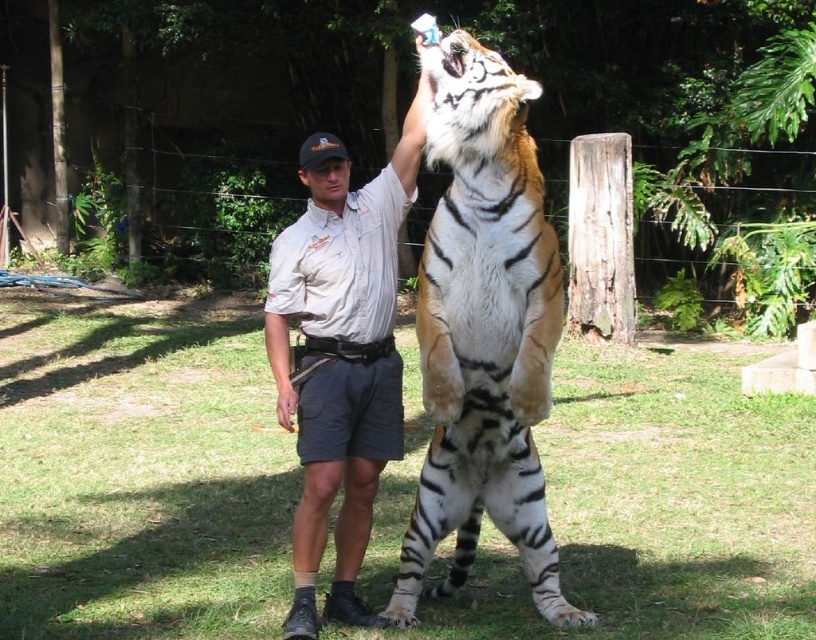
You are a visitor at the zoo and want to take a photo of the white cotton shirt at center and the white and black striped tiger at center. Which one should you focus on first to ensure both are in focus?

You should focus on the white and black striped tiger at center first because it is closer to the viewer than the white cotton shirt at center, so adjusting focus from the tiger to the shirt will help both be in focus.

You are a zookeeper standing in the enclosure with the white and black striped tiger at center and the white cotton shirt at center. Which object is wider?

The white and black striped tiger at center is wider than the white cotton shirt at center.

You are standing at the point labeled as point (386, 212) and want to walk towards the tiger. Is the point labeled as point (446, 268) between you and the tiger?

Yes, the point labeled as point (446, 268) is between you and the tiger because it is in front of point (386, 212).